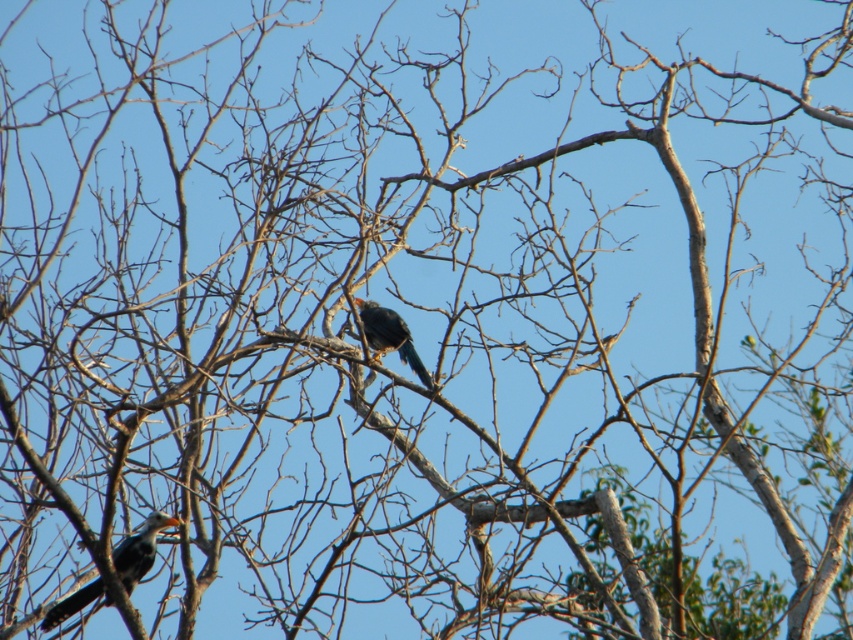
You are standing in front of the tree and want to determine which of the two birds is closer to you. The birds are located at the coordinates point (129, 564) and point (374, 337). Which bird is closer to you?

The bird at point (129, 564) is closer to the viewer than the bird at point (374, 337).

You are a birdwatcher observing the matte black bird at lower left and the shiny black bird at center in the tree. Which bird has a greater wingspan based on their sizes?

The matte black bird at lower left has a greater wingspan than the shiny black bird at center because it is larger in size.

You are a photographer aiming to capture the matte black bird at lower left in your shot. The camera you are using has a focal length of 50mm and an aperture of f2.8. Based on the scene, can you determine if the bird is within the camera frame?

The matte black bird at lower left is located at point (138, 548) in the 2D frame, so it is within the camera frame.